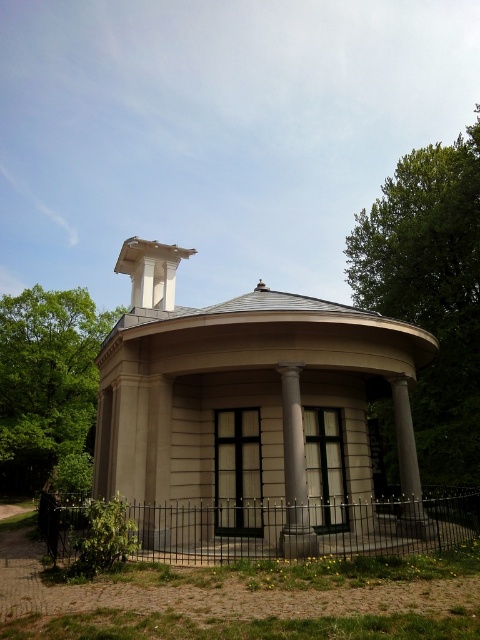
Measure the distance between point (x=387, y=408) and camera.

The distance of point (x=387, y=408) from camera is 24.37 meters.

Can you confirm if green leafy tree at upper right is thinner than white smooth column at center?

No, green leafy tree at upper right is not thinner than white smooth column at center.

Where is `green leafy tree at upper right`? Image resolution: width=480 pixels, height=640 pixels. green leafy tree at upper right is located at coordinates (431, 291).

Which is more to the right, beige stone gazebo at center or green leafy tree at upper right?

green leafy tree at upper right is more to the right.

Is beige stone gazebo at center shorter than green leafy tree at upper right?

Indeed, beige stone gazebo at center has a lesser height compared to green leafy tree at upper right.

Where is `beige stone gazebo at center`? beige stone gazebo at center is located at coordinates (249, 412).

Looking at this image, is green leafy tree at upper right taller than white marble chimney at upper center?

Correct, green leafy tree at upper right is much taller as white marble chimney at upper center.

Does point (404, 189) come in front of point (151, 296)?

No, (404, 189) is further to viewer.

Where is `green leafy tree at upper right`? The image size is (480, 640). green leafy tree at upper right is located at coordinates (431, 291).